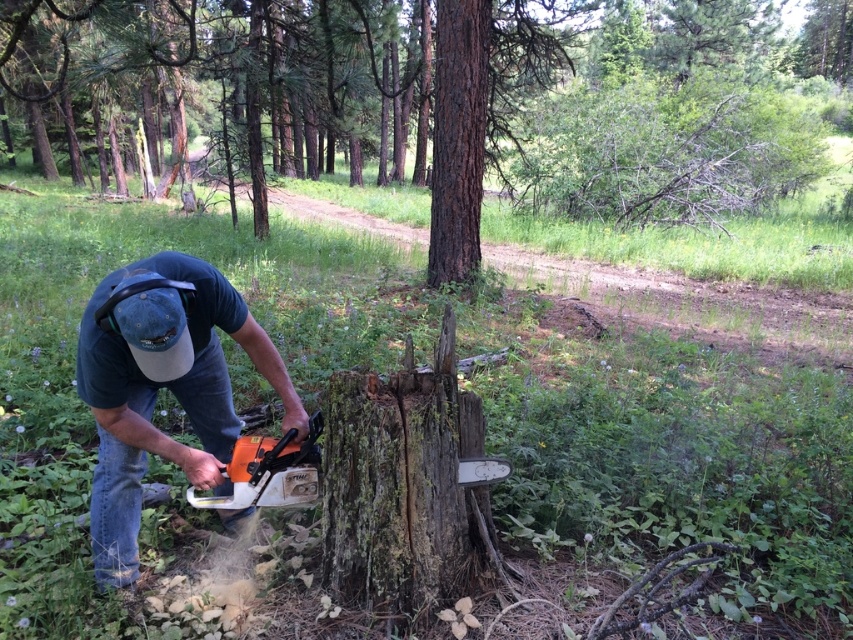
Who is positioned more to the left, smooth bark tree stump at center or orange plastic chainsaw at lower left?

orange plastic chainsaw at lower left is more to the left.

Is smooth bark tree stump at center closer to the viewer compared to orange plastic chainsaw at lower left?

No, smooth bark tree stump at center is further to the viewer.

Which is behind, point (670, 24) or point (138, 316)?

Point (670, 24)

The height and width of the screenshot is (640, 853). I want to click on smooth bark tree stump at center, so click(x=434, y=102).

Is smooth bark tree stump at center positioned at the back of brown rough bark tree trunk at center?

No, it is not.

Between point (605, 179) and point (483, 83), which one is positioned in front?

Point (483, 83) is in front.

Locate an element on the screen. Image resolution: width=853 pixels, height=640 pixels. smooth bark tree stump at center is located at coordinates (434, 102).

Which is more to the left, orange plastic chainsaw at lower left or brown rough bark tree trunk at center?

Positioned to the left is orange plastic chainsaw at lower left.

Between orange plastic chainsaw at lower left and brown rough bark tree trunk at center, which one is positioned lower?

orange plastic chainsaw at lower left

The height and width of the screenshot is (640, 853). What do you see at coordinates (161, 387) in the screenshot?
I see `orange plastic chainsaw at lower left` at bounding box center [161, 387].

Locate an element on the screen. This screenshot has height=640, width=853. orange plastic chainsaw at lower left is located at coordinates (161, 387).